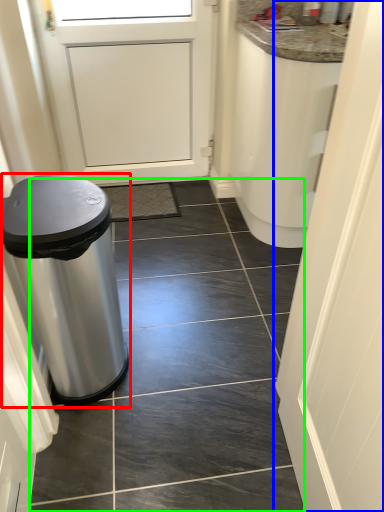
Question: Based on their relative distances, which object is nearer to waste container (highlighted by a red box)? Choose from door (highlighted by a blue box) and tile (highlighted by a green box).

Choices:
 (A) door
 (B) tile

Answer: (B)